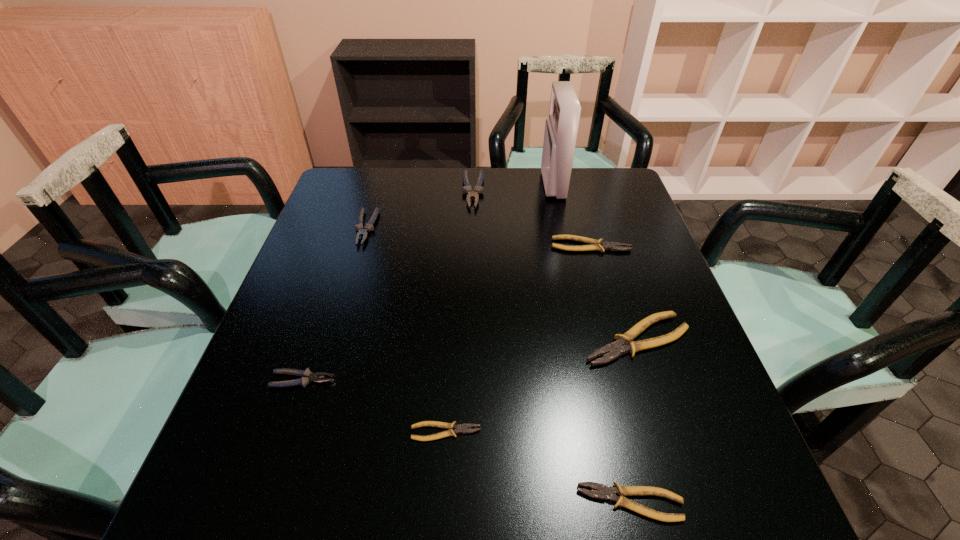
Identify which yellow pliers is the nearest to the red first-aid kit. Please provide its 2D coordinates. Your answer should be formatted as a tuple, i.e. [(x, y)], where the tuple contains the x and y coordinates of a point satisfying the conditions above.

[(598, 245)]

This screenshot has height=540, width=960. I want to click on vacant space that satisfies the following two spatial constraints: 1. at the gripping part of the second biggest gray pliers; 2. at the gripping part of the nearest gray pliers, so click(x=320, y=380).

Locate an element on the screen. This screenshot has width=960, height=540. free region that satisfies the following two spatial constraints: 1. on the front-facing side of the first-aid kit; 2. on the back side of the farthest yellow pliers is located at coordinates (566, 246).

Identify the location of vacant point that satisfies the following two spatial constraints: 1. at the gripping part of the second biggest gray pliers; 2. on the right side of the farthest yellow pliers. Image resolution: width=960 pixels, height=540 pixels. pos(361,246).

At what (x,y) coordinates should I click in order to perform the action: click on free space that satisfies the following two spatial constraints: 1. at the gripping part of the second biggest gray pliers; 2. at the gripping part of the smallest gray pliers. Please return your answer as a coordinate pair (x, y). The image size is (960, 540). Looking at the image, I should click on (320, 380).

Where is `vacant region that satisfies the following two spatial constraints: 1. at the gripping part of the second smallest yellow pliers; 2. on the right side of the sixth farthest object`? vacant region that satisfies the following two spatial constraints: 1. at the gripping part of the second smallest yellow pliers; 2. on the right side of the sixth farthest object is located at coordinates 262,503.

You are a GUI agent. You are given a task and a screenshot of the screen. Output one action in this format:
    pyautogui.click(x=<x>, y=<y>)
    Task: Click on the vacant area that satisfies the following two spatial constraints: 1. at the gripping part of the second biggest gray pliers; 2. at the gripping part of the smallest gray pliers
    Image resolution: width=960 pixels, height=540 pixels.
    Given the screenshot: What is the action you would take?
    pyautogui.click(x=320, y=380)

Locate an element on the screen. free location that satisfies the following two spatial constraints: 1. on the front-facing side of the tallest object; 2. on the left side of the farthest yellow pliers is located at coordinates (566, 246).